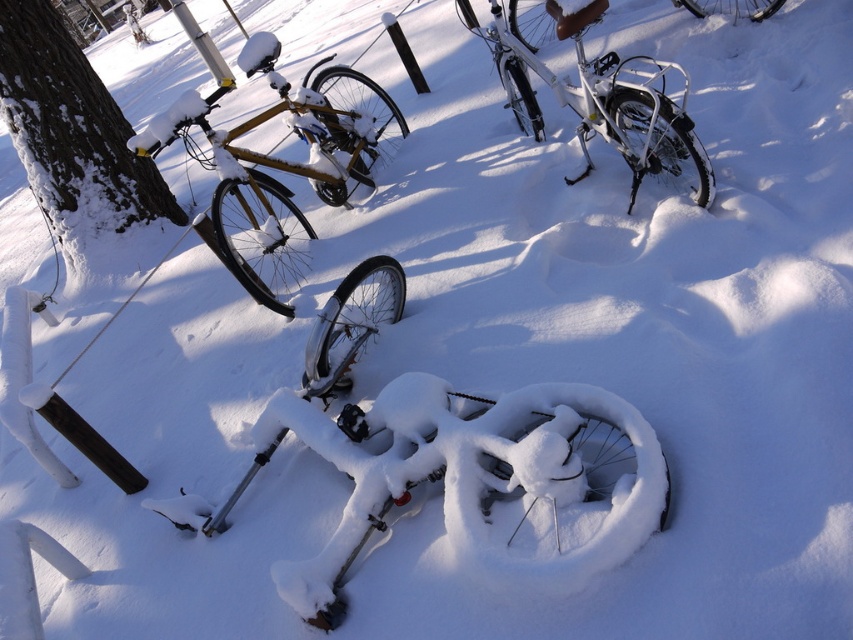
Question: Which of the following is the closest to the observer?

Choices:
 (A) shiny gold bicycle at left
 (B) white matte bicycle at upper center
 (C) dark brown bark tree at left

Answer: (B)

Question: Among these points, which one is nearest to the camera?

Choices:
 (A) (263, 116)
 (B) (32, 115)
 (C) (689, 12)

Answer: (A)

Question: Can you confirm if shiny gold bicycle at left is bigger than white matte bicycle at upper center?

Choices:
 (A) no
 (B) yes

Answer: (B)

Question: Does dark brown bark tree at left have a lesser width compared to shiny silver bicycle at upper right?

Choices:
 (A) no
 (B) yes

Answer: (A)

Question: Can you confirm if shiny gold bicycle at left is positioned below shiny silver bicycle at upper right?

Choices:
 (A) yes
 (B) no

Answer: (A)

Question: Which point is closer to the camera?

Choices:
 (A) white matte bicycle at upper center
 (B) dark brown bark tree at left

Answer: (A)